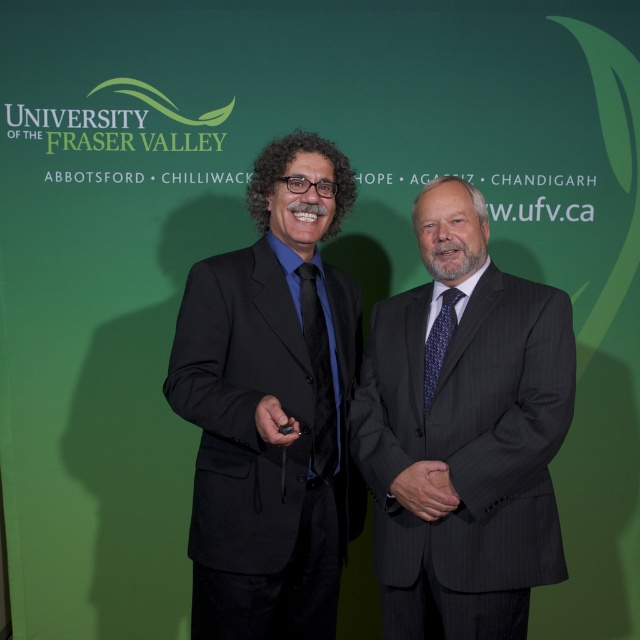
You are a fashion designer observing two suits displayed against a university backdrop. The dark gray pinstripe suit at center is in front of the black matte suit at center. Which suit is closer to the viewer?

The dark gray pinstripe suit at center is closer to the viewer because it is in front of the black matte suit at center.

You are standing at the point labeled point (328,195) in the image. If you want to take a photo of the University of the Fraser Valley backdrop, which direction should you move to get the entire backdrop in your camera frame?

You should move away from the backdrop because the point (328,195) is only 5.64 feet away from the camera, so moving back would allow the camera to capture the entire backdrop.

In the scene shown: You are attending a career fair and need to identify which suit is closer to the floor. You see the dark gray pinstripe suit at center and the black matte suit at center. Which one is positioned lower?

The dark gray pinstripe suit at center is positioned under the black matte suit at center, so it is lower to the floor.